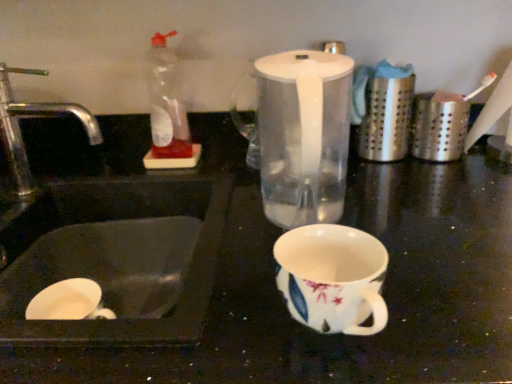
Identify the location of vacant space to the right of transparent plastic blender at center. (424, 208).